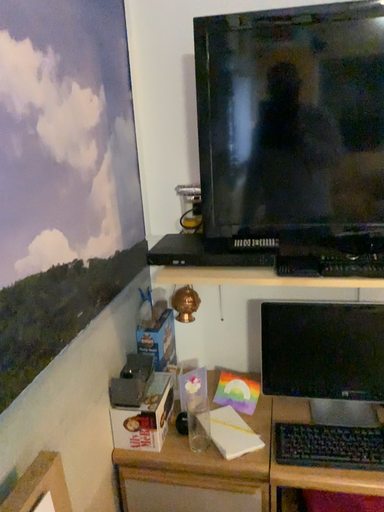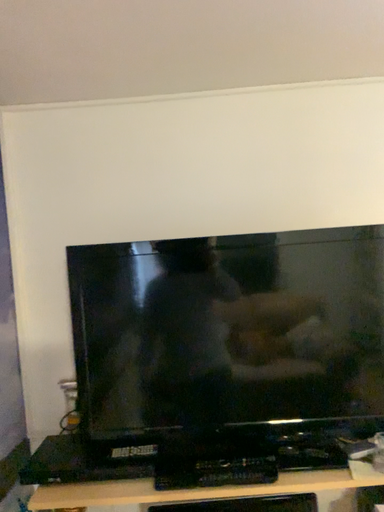
Question: Which way did the camera rotate in the video?

Choices:
 (A) rotated right
 (B) rotated left

Answer: (A)